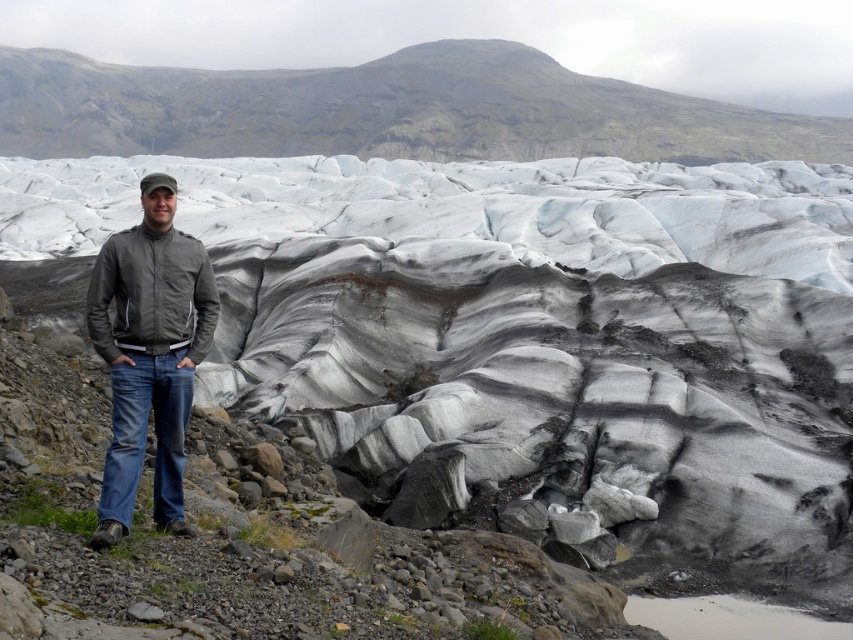
Question: Which object appears closest to the camera in this image?

Choices:
 (A) matte gray jacket at center
 (B) gray/white ice glacier at center

Answer: (A)

Question: Which of the following is the farthest from the observer?

Choices:
 (A) (9, 161)
 (B) (154, 243)

Answer: (A)

Question: Does gray/white ice glacier at center appear over matte gray jacket at center?

Choices:
 (A) no
 (B) yes

Answer: (B)

Question: Where is gray/white ice glacier at center located in relation to matte gray jacket at center in the image?

Choices:
 (A) right
 (B) left

Answer: (A)

Question: Is the position of gray/white ice glacier at center less distant than that of matte gray jacket at center?

Choices:
 (A) no
 (B) yes

Answer: (A)

Question: Which object appears closest to the camera in this image?

Choices:
 (A) matte gray jacket at center
 (B) gray/white ice glacier at center

Answer: (A)